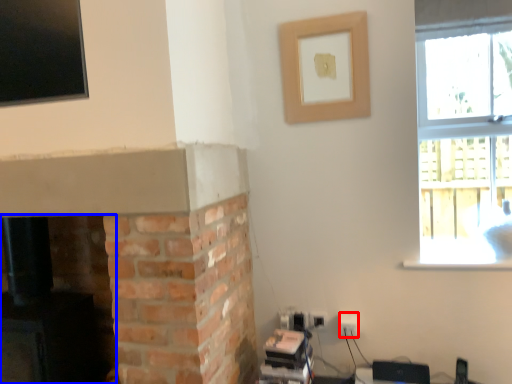
Question: Which of the following is the farthest to the observer, electric outlet (highlighted by a red box) or fireplace (highlighted by a blue box)?

Choices:
 (A) electric outlet
 (B) fireplace

Answer: (A)